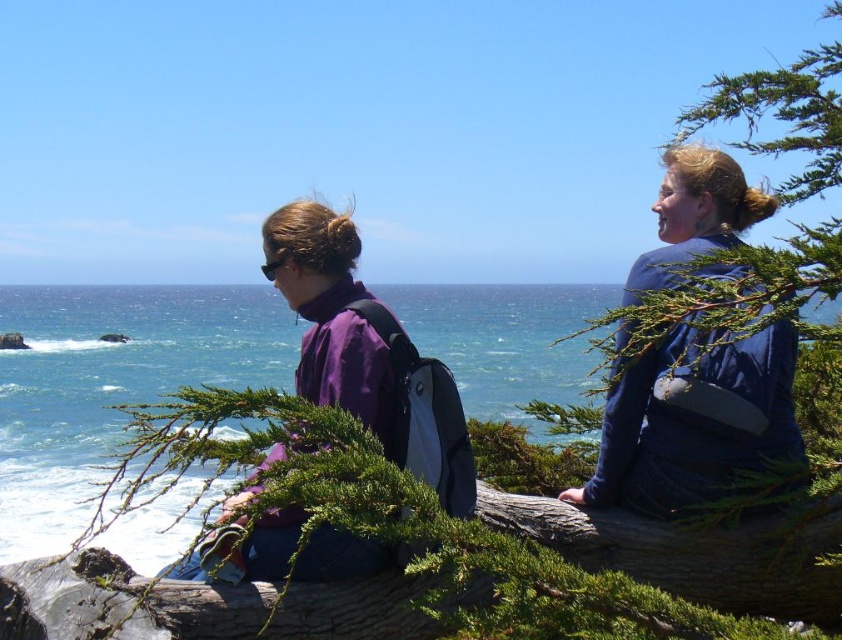
Measure the distance from blue water at center to blue fabric jacket at upper right.

They are 476.81 feet apart.

Identify the location of blue water at center. (112, 385).

This screenshot has width=842, height=640. What do you see at coordinates (112, 385) in the screenshot? I see `blue water at center` at bounding box center [112, 385].

At what (x,y) coordinates should I click in order to perform the action: click on blue water at center. Please return your answer as a coordinate pair (x, y). Looking at the image, I should click on (112, 385).

From the picture: Can you confirm if blue fabric jacket at upper right is wider than purple matte jacket at center?

In fact, blue fabric jacket at upper right might be narrower than purple matte jacket at center.

Can you confirm if blue fabric jacket at upper right is positioned to the left of purple matte jacket at center?

No, blue fabric jacket at upper right is not to the left of purple matte jacket at center.

Describe the element at coordinates (693, 420) in the screenshot. The height and width of the screenshot is (640, 842). I see `blue fabric jacket at upper right` at that location.

I want to click on blue fabric jacket at upper right, so click(x=693, y=420).

Can you confirm if blue water at center is smaller than purple matte jacket at center?

No, blue water at center is not smaller than purple matte jacket at center.

Who is more distant from viewer, (35, 476) or (350, 228)?

The point (35, 476) is behind.

At what (x,y) coordinates should I click in order to perform the action: click on blue water at center. Please return your answer as a coordinate pair (x, y). Image resolution: width=842 pixels, height=640 pixels. Looking at the image, I should click on (112, 385).